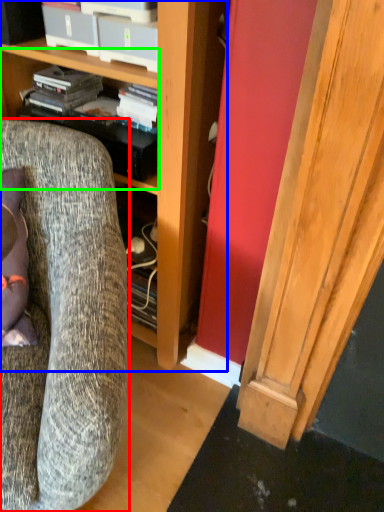
Question: Which object is the closest to the chair (highlighted by a red box)? Choose among these: cabinetry (highlighted by a blue box) or shelf (highlighted by a green box).

Choices:
 (A) cabinetry
 (B) shelf

Answer: (A)